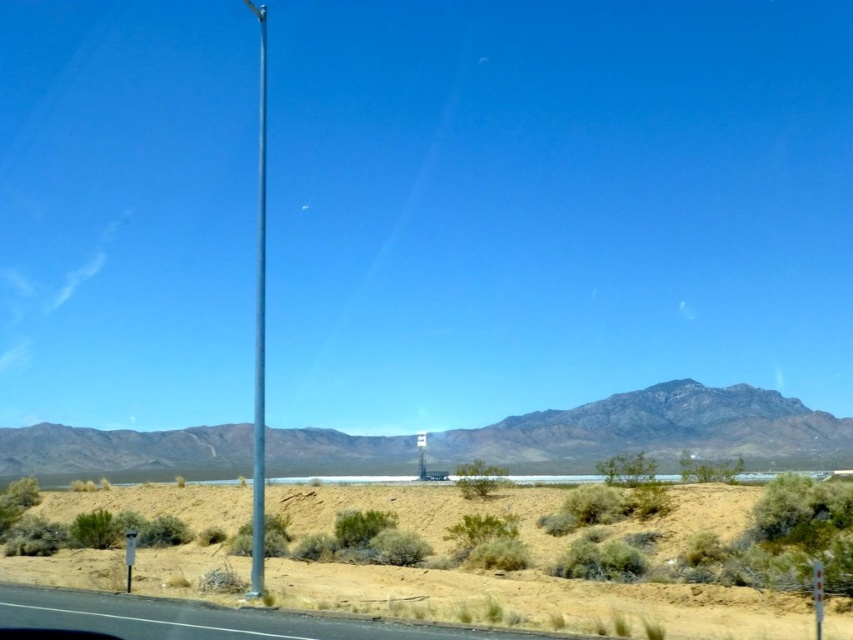
You are a photographer planning to take a picture of the desert landscape. You want to include both the clear glass pole at center and the metallic pole at left in your shot. Which pole will appear closer to the top of your photo?

The clear glass pole at center appears closer to the top of the photo because it is positioned above the metallic pole at left.

Consider the image. You are a hiker planning to walk from the dried grass at lower center to the rocky brown mountain at center. Based on the scene description, which object is taller and would likely require more effort to climb?

The rocky brown mountain at center is taller than the dried grass at lower center, so it would likely require more effort to climb.

You are standing at the center of the desert scene and want to place a small marker exactly where the dried grass at lower center is located. According to the coordinates provided, what are the exact coordinates where you should place the marker?

The dried grass at lower center is located at the 2D coordinates of point [505,573], so you should place the marker at those exact coordinates.